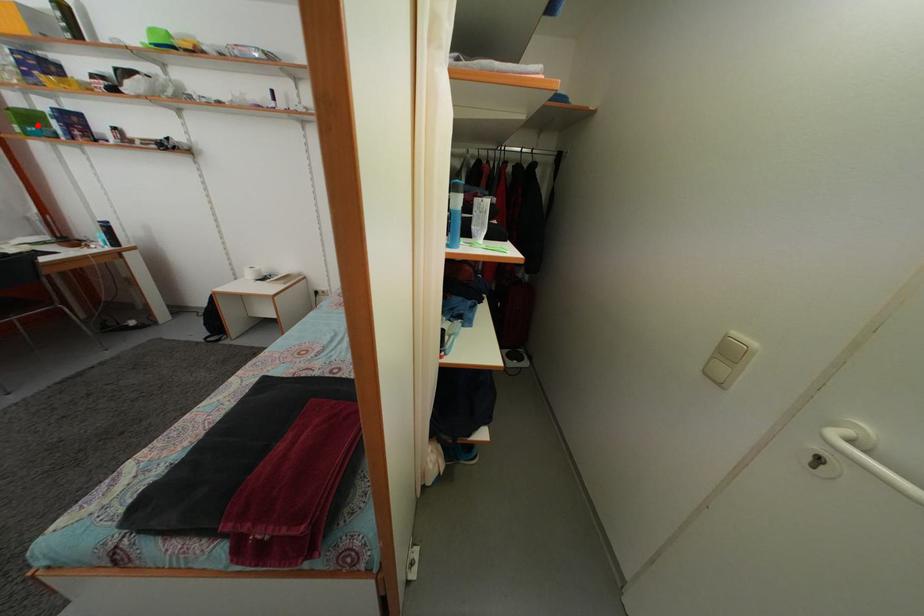
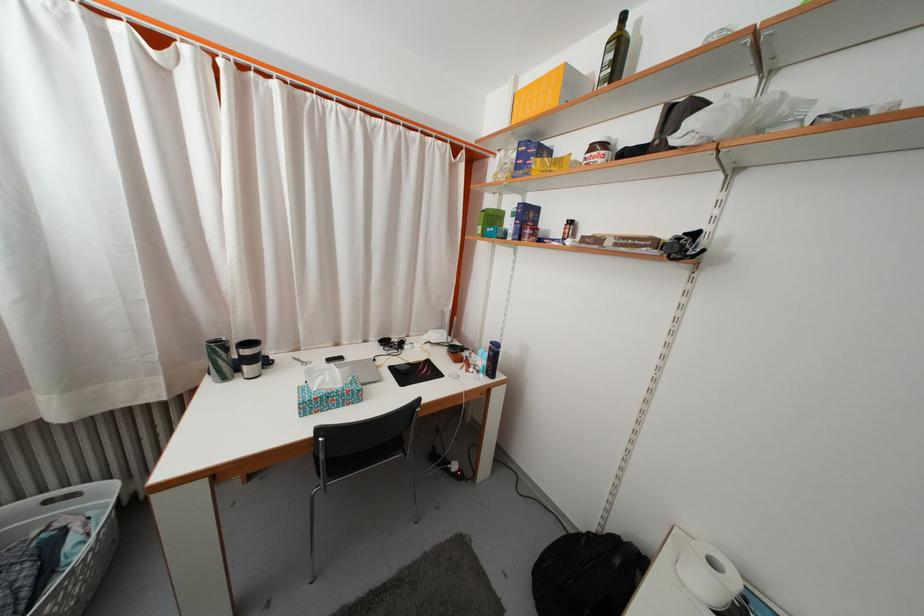
Question: I am providing you with two images of the same scene from different viewpoints. Given a red point in image1, look at the same physical point in image2. Is it:

Choices:
 (A) Closer to the viewpoint
 (B) Farther from the viewpoint

Answer: (A)